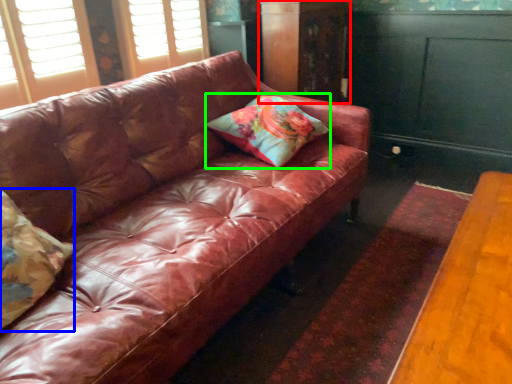
Question: Which object is the farthest from dresser (highlighted by a red box)? Choose among these: pillow (highlighted by a blue box) or pillow (highlighted by a green box).

Choices:
 (A) pillow
 (B) pillow

Answer: (A)